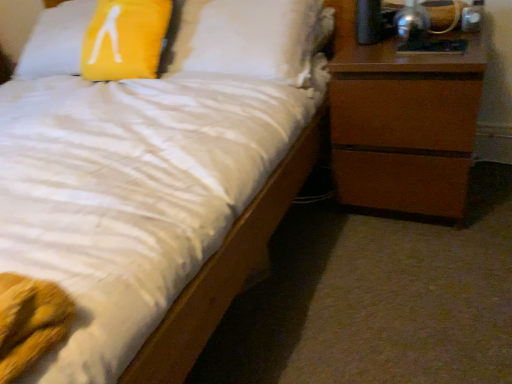
At what (x,y) coordinates should I click in order to perform the action: click on vacant space in front of metallic silver lamp at upper right. Please return your answer as a coordinate pair (x, y). This screenshot has width=512, height=384. Looking at the image, I should click on (433, 48).